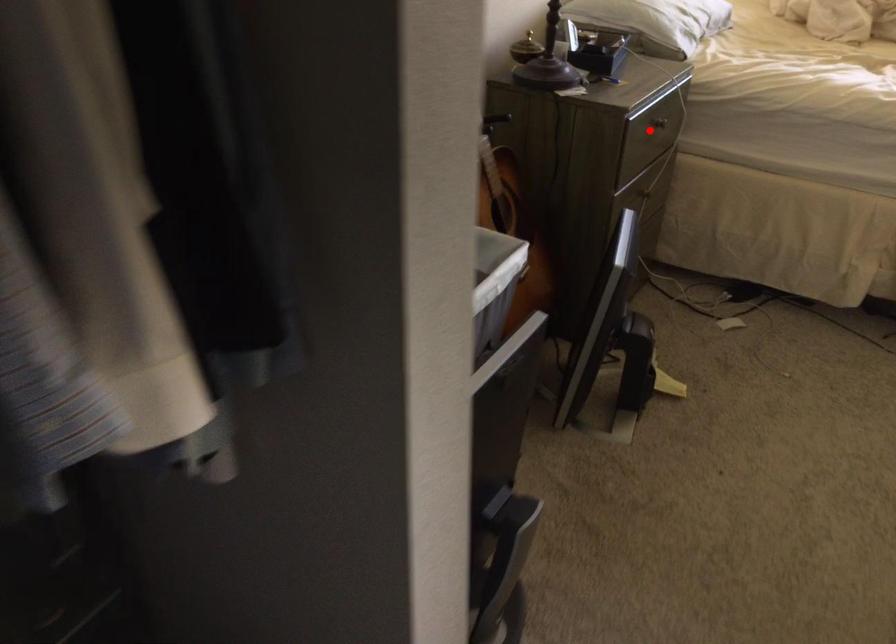
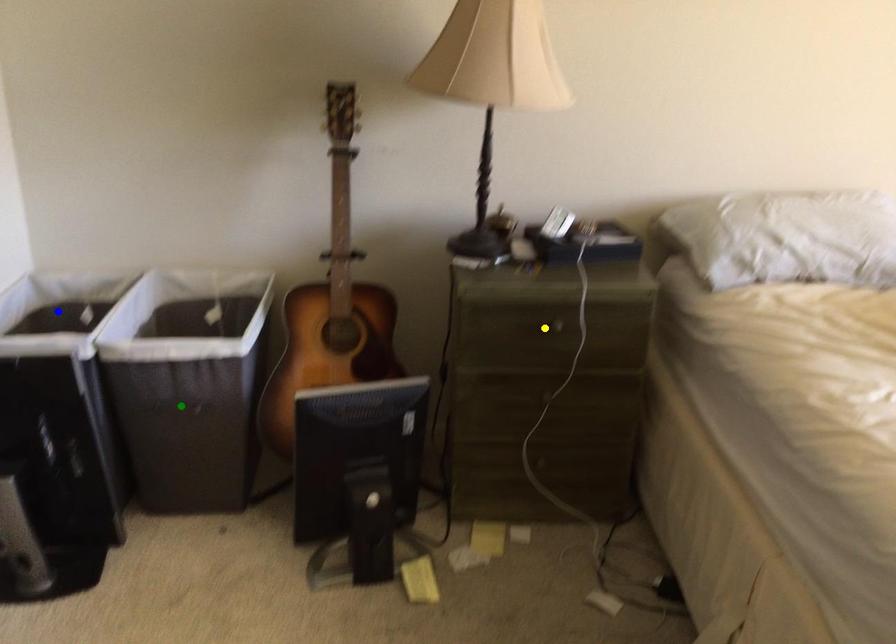
Question: I am providing you with two images of the same scene from different viewpoints. A red point is marked on the first image. You are given multiple points on the second image. In image 2, which mark is for the same physical point as the one in image 1?

Choices:
 (A) blue point
 (B) yellow point
 (C) green point

Answer: (B)